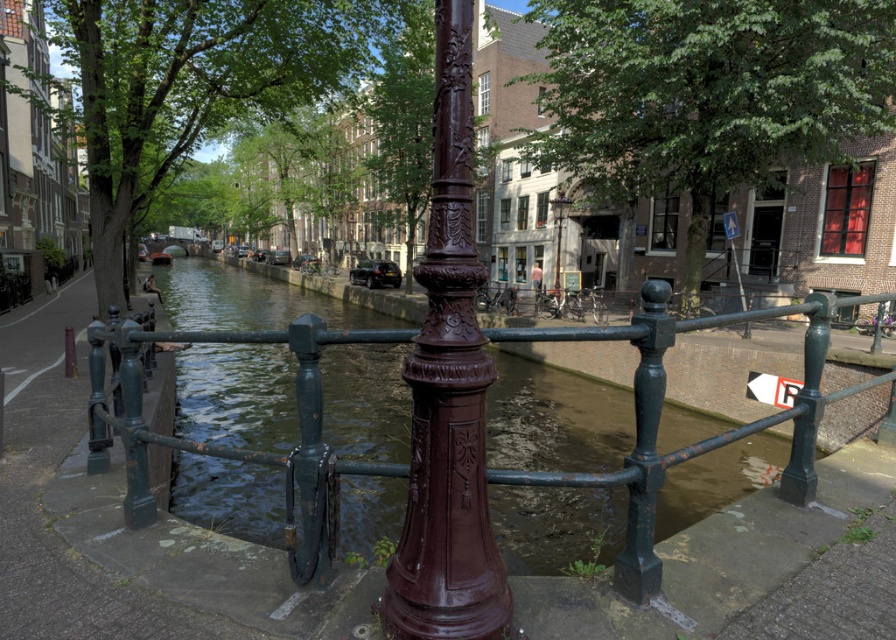
Looking at this image, you are a delivery person with a cart that is 10 feet wide. You need to navigate through the space between the green matte fence at center and the polished bronze lamp post at center. Can your cart fit through the space between them?

The distance between the green matte fence at center and the polished bronze lamp post at center is 43.59 feet, which is significantly wider than the cart that is 10 feet wide. Therefore, the cart can easily fit through the space between them.

You are a city planner assessing the canal area. You need to install a new decorative element between the polished bronze lamp post at center and the metallic blue sign at upper right. Which object should you place closer to the narrower side to maintain balance?

The polished bronze lamp post at center has a lesser width compared to the metallic blue sign at upper right. To maintain balance, place the new decorative element closer to the polished bronze lamp post at center since it is narrower.

You are a delivery person with a cart that is 1.2 meters wide. You need to pass through the space between the green matte fence at center and the polished bronze lamp post at center. Can your cart fit through the space?

The green matte fence at center might be wider than polished bronze lamp post at center, but the description does not provide exact measurements of the space between them. Without knowing the exact width of the gap, it is uncertain if the cart can fit through the space.